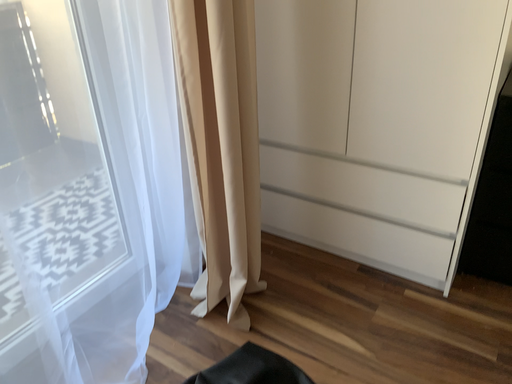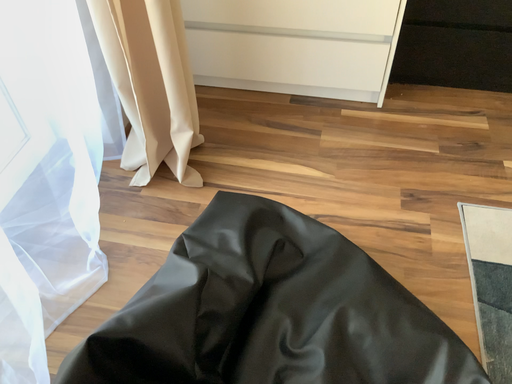
Question: Which way did the camera rotate in the video?

Choices:
 (A) rotated upward
 (B) rotated downward

Answer: (B)